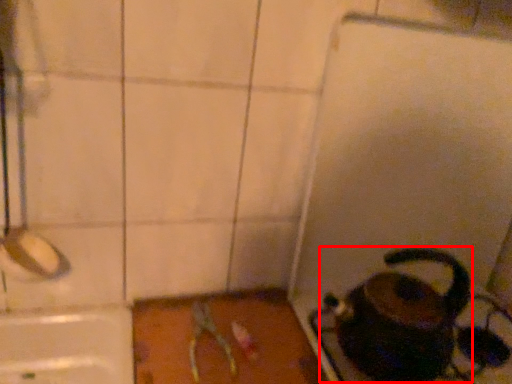
Question: In this image, where is coffeepot (annotated by the red box) located relative to scissors?

Choices:
 (A) left
 (B) right

Answer: (B)